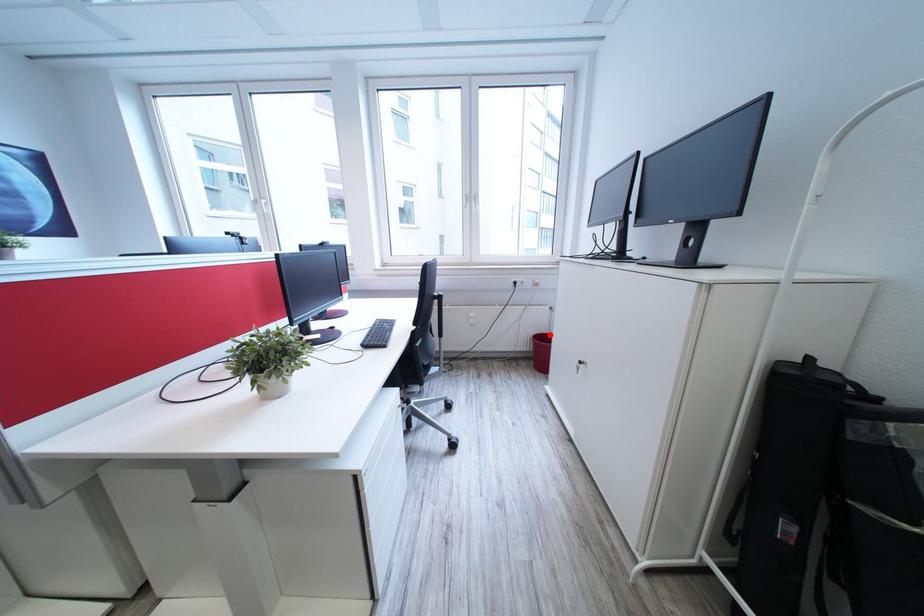
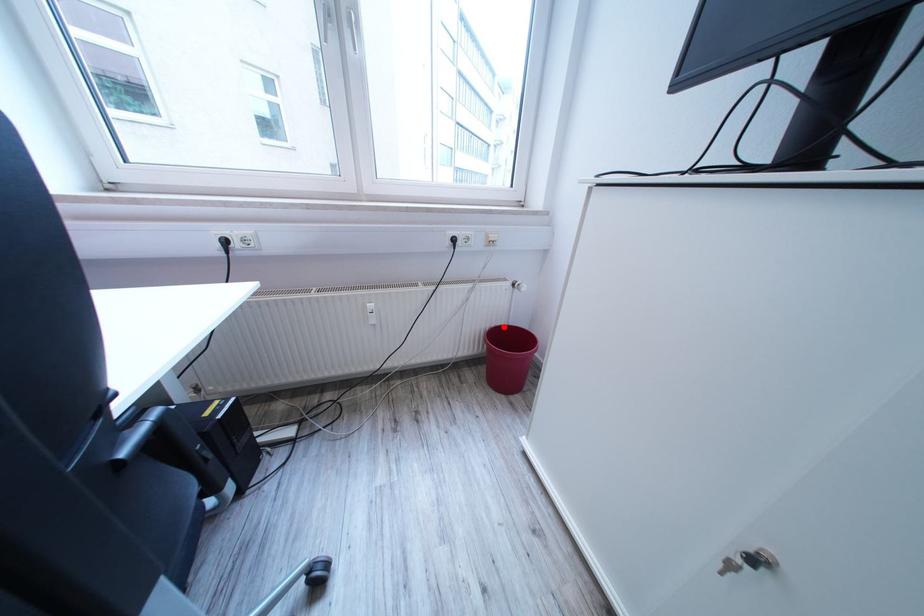
I am providing you with two images of the same scene from different viewpoints. A red point is marked on the first image and another point is marked on the second image. Do the highlighted points in image1 and image2 indicate the same real-world spot?

Yes